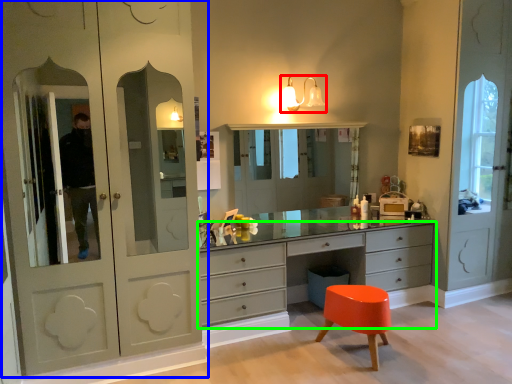
Question: Considering the real-world distances, which object is closest to light fixture (highlighted by a red box)? cupboard (highlighted by a blue box) or chest of drawers (highlighted by a green box).

Choices:
 (A) cupboard
 (B) chest of drawers

Answer: (B)